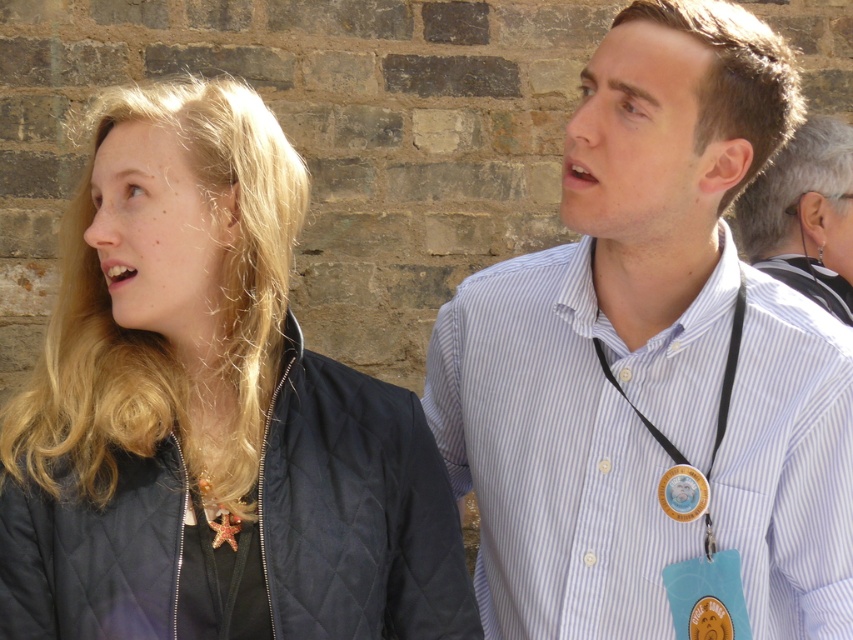
Based on the photo, does quilted navy jacket at left have a greater height compared to white striped shirt at upper right?

Yes.

Is point (395, 512) positioned before point (811, 131)?

Yes, point (395, 512) is closer to viewer.

Identify the location of quilted navy jacket at left. The width and height of the screenshot is (853, 640). (210, 413).

Between point (300, 612) and point (665, 500), which one is positioned behind?

Positioned behind is point (665, 500).

Can you confirm if quilted navy jacket at left is positioned above gold metallic badge at center?

Yes.

Which is behind, point (106, 579) or point (697, 512)?

The point (697, 512) is more distant.

What are the coordinates of `quilted navy jacket at left` in the screenshot? It's located at (210, 413).

Which is more to the left, white striped shirt at center or white striped shirt at upper right?

From the viewer's perspective, white striped shirt at center appears more on the left side.

Identify the location of white striped shirt at center. (610, 326).